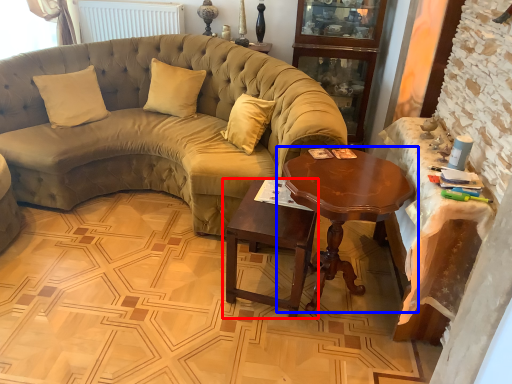
Question: Which object is closer to the camera taking this photo, table (highlighted by a red box) or coffee table (highlighted by a blue box)?

Choices:
 (A) table
 (B) coffee table

Answer: (B)